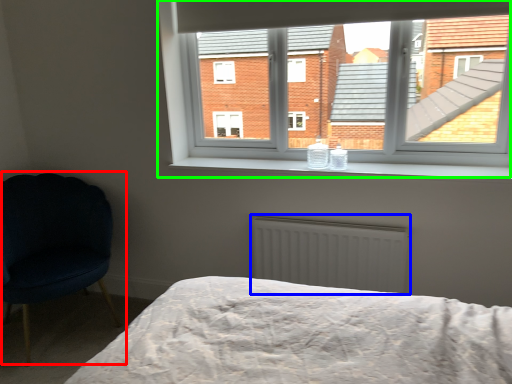
Question: Which is farther away from chair (highlighted by a red box)? radiator (highlighted by a blue box) or window (highlighted by a green box)?

Choices:
 (A) radiator
 (B) window

Answer: (A)